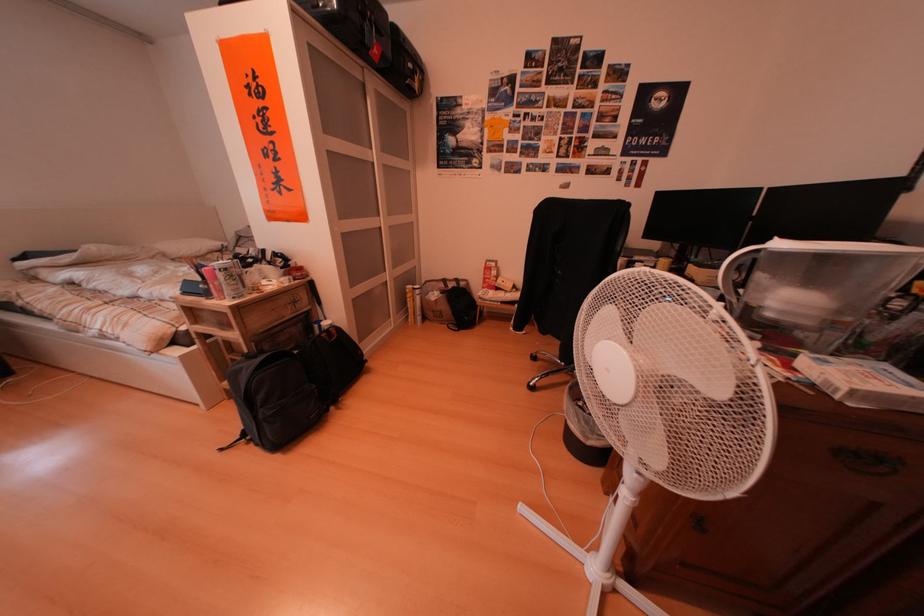
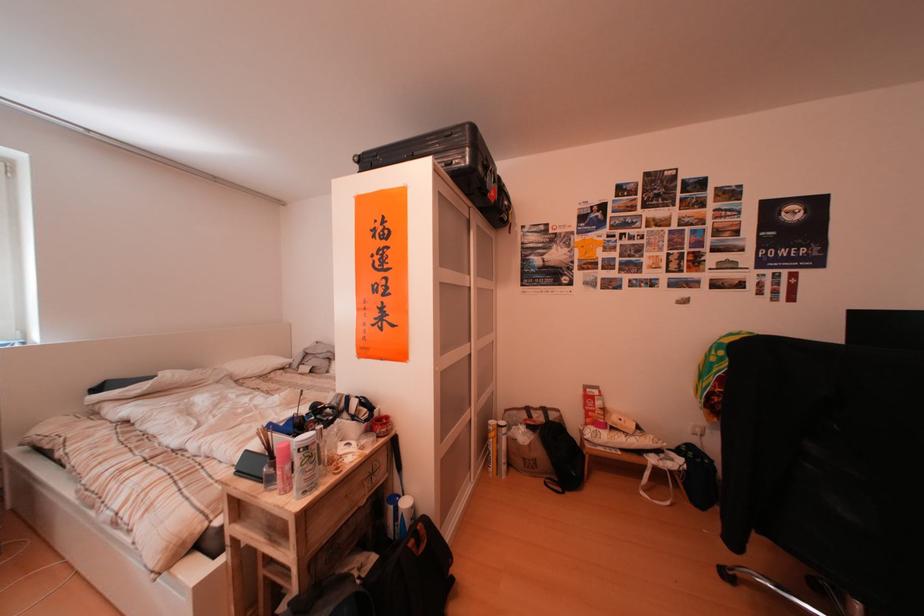
Find the pixel in the second image that matches the point at 237,275 in the first image.

(320, 453)